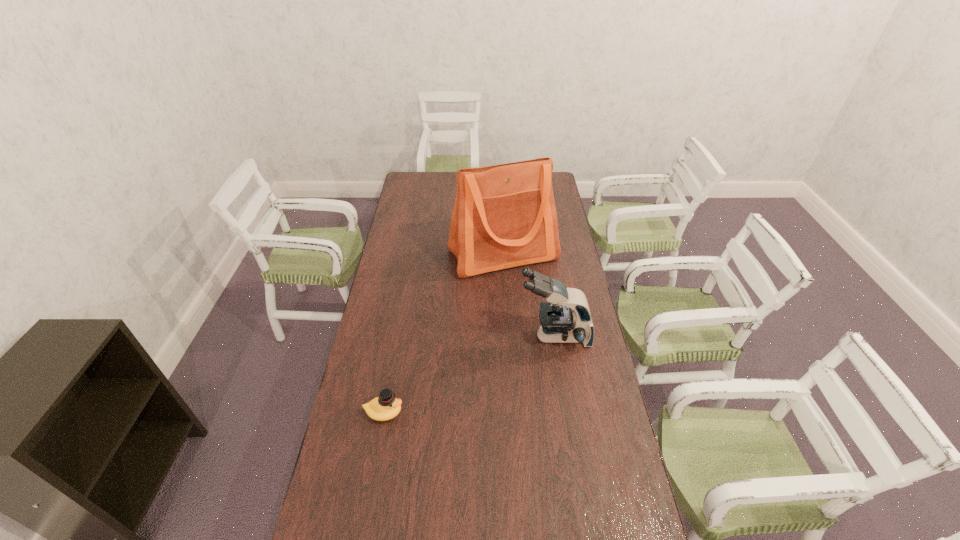
Where is `vacant area located on the front-facing side of the nearest object`? vacant area located on the front-facing side of the nearest object is located at coordinates (520, 412).

Identify the location of object that is at the left edge. This screenshot has width=960, height=540. (385, 407).

Identify the location of shopping bag present at the right edge. Image resolution: width=960 pixels, height=540 pixels. (504, 216).

Find the location of a particular element. microscope located at the right edge is located at coordinates (566, 317).

Locate an element on the screen. The image size is (960, 540). blank space at the left edge of the desktop is located at coordinates (396, 359).

At what (x,y) coordinates should I click in order to perform the action: click on free spot at the right edge of the desktop. Please return your answer as a coordinate pair (x, y). Looking at the image, I should click on (629, 509).

What are the coordinates of `free point between the second tallest object and the duck` in the screenshot? It's located at (468, 374).

This screenshot has width=960, height=540. I want to click on vacant space in between the farthest object and the second tallest object, so point(529,295).

Image resolution: width=960 pixels, height=540 pixels. In order to click on free area in between the tallest object and the microscope in this screenshot , I will do `click(529, 295)`.

I want to click on vacant region between the tallest object and the microscope, so click(529, 295).